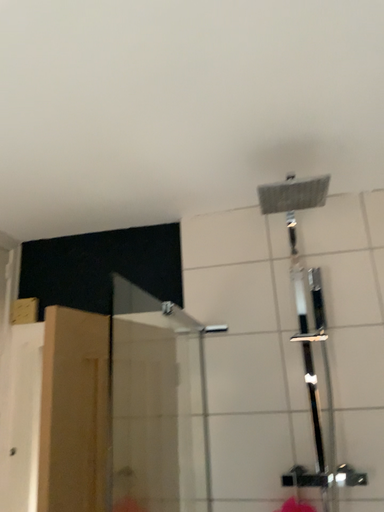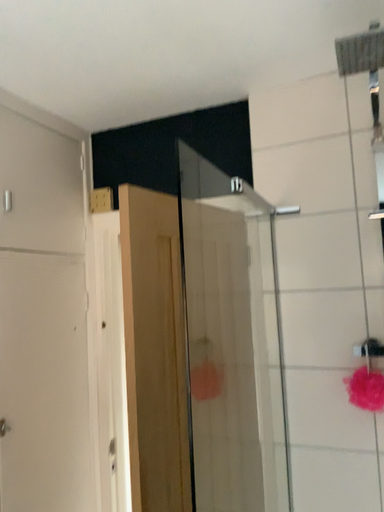
Question: Which way did the camera rotate in the video?

Choices:
 (A) rotated downward
 (B) rotated upward

Answer: (A)